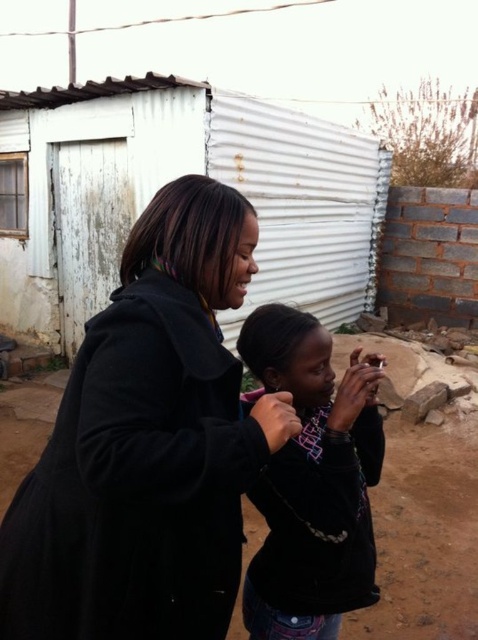
Question: Is white corrugated metal hut at center above dark blue fleece jacket at center?

Choices:
 (A) no
 (B) yes

Answer: (B)

Question: Which point is closer to the camera?

Choices:
 (A) white corrugated metal hut at center
 (B) dirt field at lower center
 (C) black fleece jacket at center

Answer: (C)

Question: Is black fleece jacket at center below dark blue fleece jacket at center?

Choices:
 (A) no
 (B) yes

Answer: (A)

Question: In this image, where is white corrugated metal hut at center located relative to dirt field at lower center?

Choices:
 (A) right
 (B) left

Answer: (B)

Question: Among these points, which one is farthest from the camera?

Choices:
 (A) pyautogui.click(x=126, y=243)
 (B) pyautogui.click(x=314, y=557)
 (C) pyautogui.click(x=196, y=100)
 (D) pyautogui.click(x=414, y=609)

Answer: (A)

Question: Which point is closer to the camera?

Choices:
 (A) (40, 337)
 (B) (267, 392)

Answer: (B)